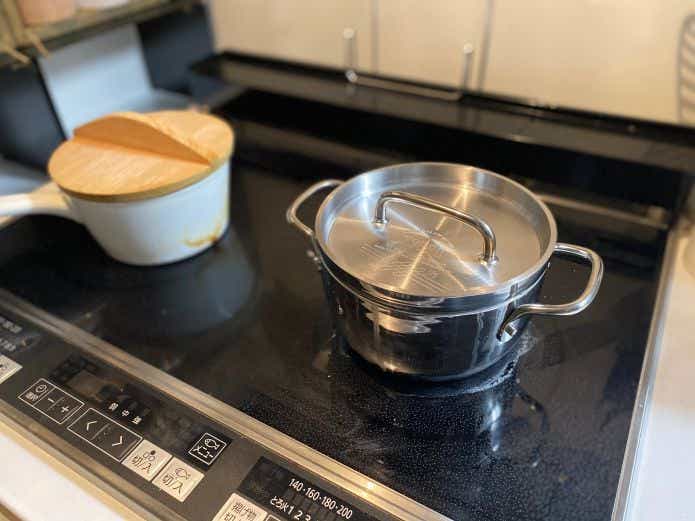
Where is `handle of the lid`? handle of the lid is located at coordinates (430, 204).